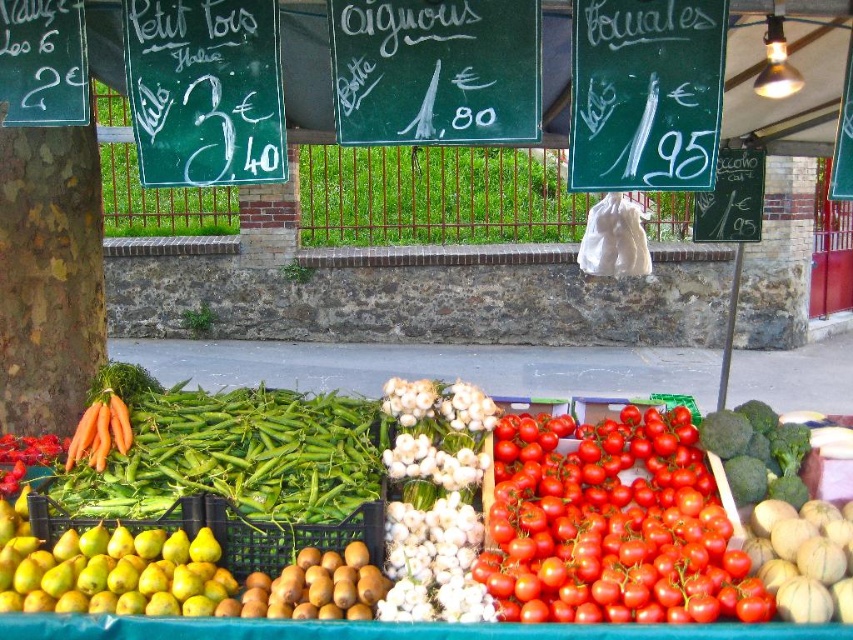
In the scene shown: You are a customer at the market and want to know which item is taller between the green glossy beans at center and the yellow matte pears at lower left. Can you tell me?

The green glossy beans at center is taller than yellow matte pears at lower left.

You are a photographer standing at the center of the market. You want to take a photo that includes both the yellow pears and golden kiwis on the left and the ripe red tomatoes on the right. Which of the two points, point 1 at coordinates [520,35] or point 2 at coordinates [596,13], should you focus on to ensure both areas are in sharp focus?

To ensure both the yellow pears and golden kiwis on the left and the ripe red tomatoes on the right are in sharp focus, you should focus on point 1 at coordinates [520,35] because it is closer to the camera than point 2 at coordinates [596,13]. Focusing on the closer point will help keep both foreground and background elements in focus.

You are a customer at the market and want to compare the width of the green glossy beans at center and the yellow matte pears at lower left. Which one is wider?

The green glossy beans at center might be wider than yellow matte pears at lower left according to the description.